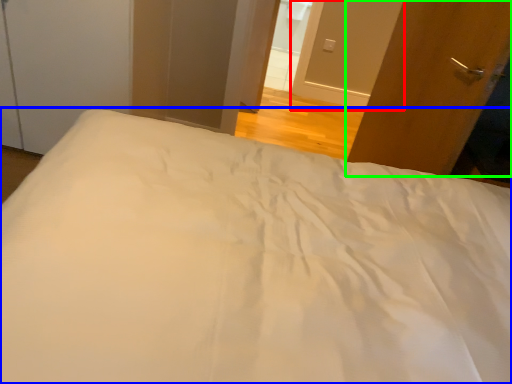
Question: Considering the real-world distances, which object is closest to screen door (highlighted by a red box)? bed (highlighted by a blue box) or door (highlighted by a green box).

Choices:
 (A) bed
 (B) door

Answer: (B)